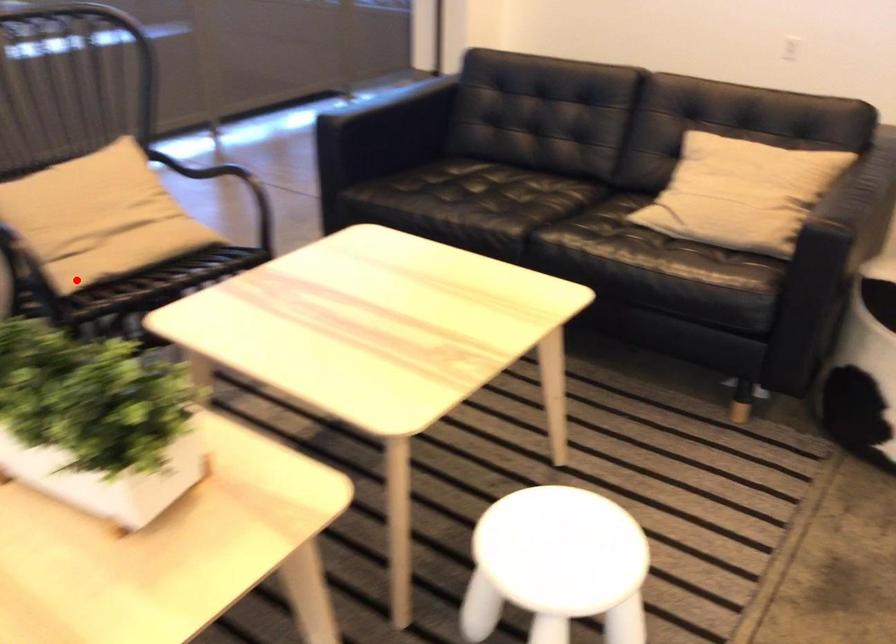
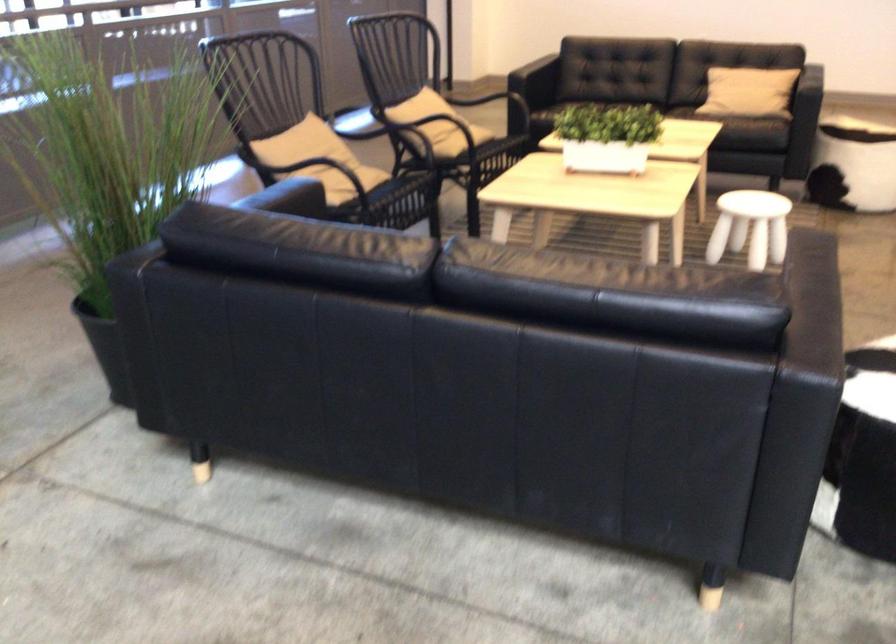
Question: I am providing you with two images of the same scene from different viewpoints. Given a red point in image1, look at the same physical point in image2. Is it:

Choices:
 (A) Closer to the viewpoint
 (B) Farther from the viewpoint

Answer: (B)